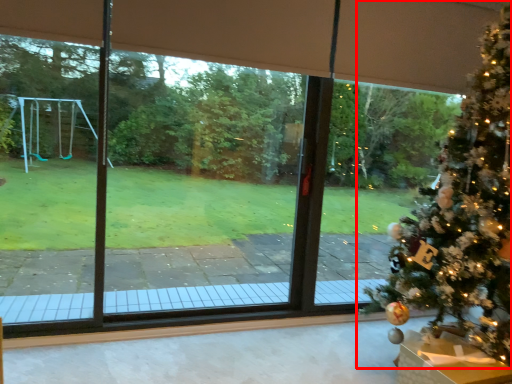
Question: From the image's perspective, what is the correct spatial positioning of christmas tree (annotated by the red box) in reference to furniture?

Choices:
 (A) below
 (B) above

Answer: (B)